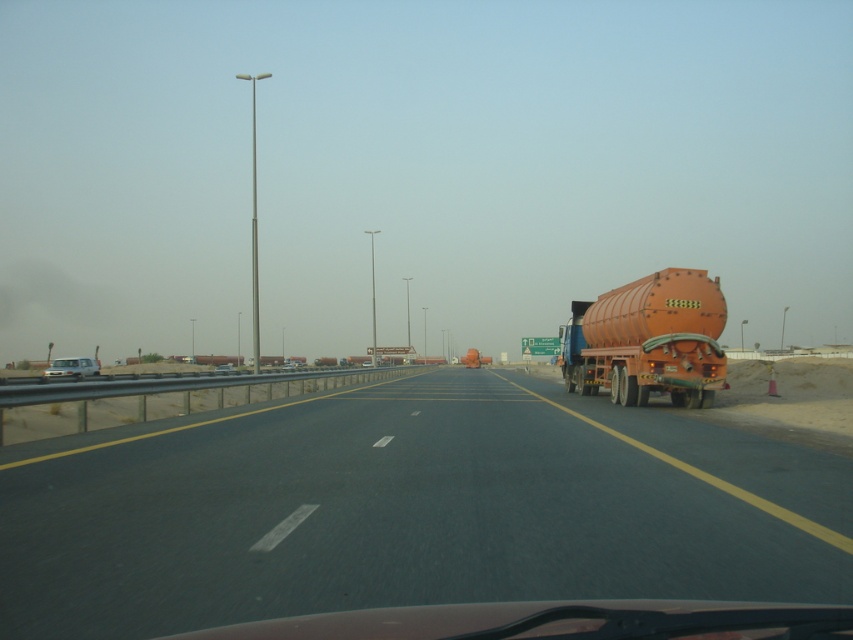
Between point (547, 554) and point (218, 369), which one is positioned behind?

Point (218, 369)

This screenshot has height=640, width=853. Find the location of `asphalt road at center`. asphalt road at center is located at coordinates (409, 509).

Who is more distant from viewer, (817,568) or (227,364)?

The point (227,364) is behind.

Where is `asphalt road at center`? This screenshot has width=853, height=640. asphalt road at center is located at coordinates (409, 509).

Locate an element on the screen. orange matte tanker at right is located at coordinates (648, 339).

Locate an element on the screen. This screenshot has height=640, width=853. orange matte tanker at right is located at coordinates (648, 339).

Where is `orange matte tanker at right`? Image resolution: width=853 pixels, height=640 pixels. orange matte tanker at right is located at coordinates (648, 339).

Which is behind, point (648, 333) or point (228, 371)?

Positioned behind is point (228, 371).

Does orange matte tanker at right appear on the right side of matte silver sedan at center?

Correct, you'll find orange matte tanker at right to the right of matte silver sedan at center.

Find the location of `orange matte tanker at right`. orange matte tanker at right is located at coordinates (648, 339).

Find the location of a particular element. orange matte tanker at right is located at coordinates (648, 339).